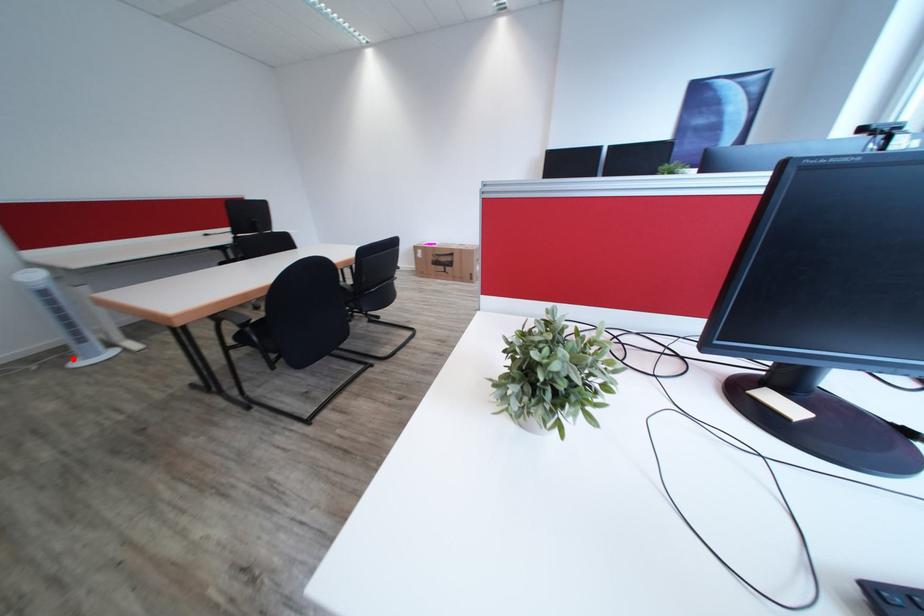
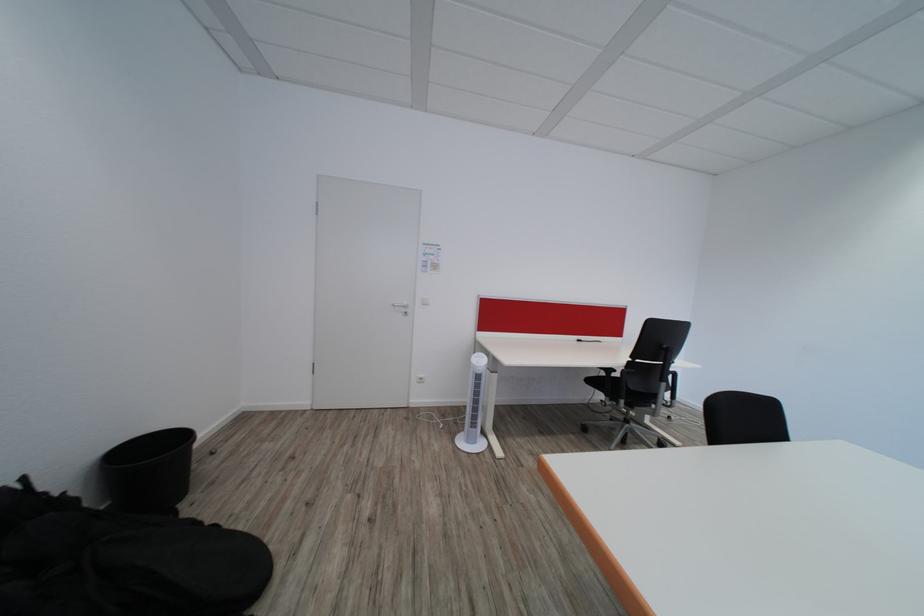
Question: I am providing you with two images of the same scene from different viewpoints. Given a red point in image1, look at the same physical point in image2. Is it:

Choices:
 (A) Closer to the viewpoint
 (B) Farther from the viewpoint

Answer: (B)